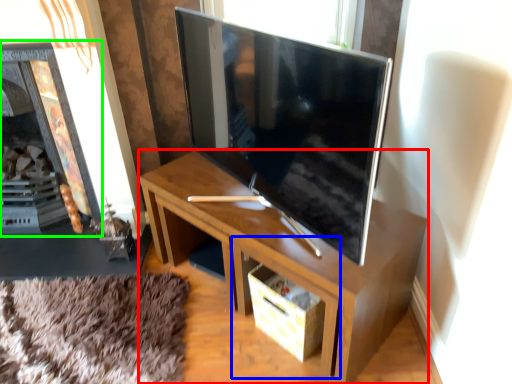
Question: Estimate the real-world distances between objects in this image. Which object is closer to desk (highlighted by a red box), drawer (highlighted by a blue box) or fireplace (highlighted by a green box)?

Choices:
 (A) drawer
 (B) fireplace

Answer: (A)